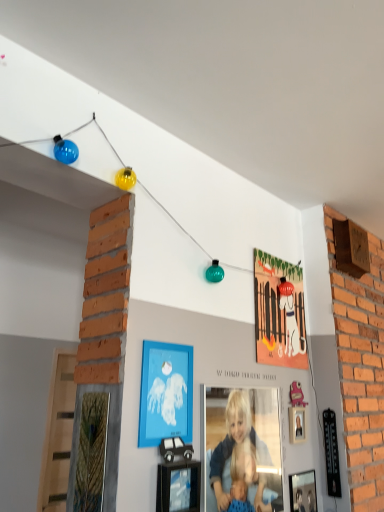
Question: Is blue matte picture frame at center, the 3th picture frame from the back, positioned before matte orange picture frame at upper center, arranged as the 2th picture frame when viewed from the right?

Choices:
 (A) no
 (B) yes

Answer: (B)

Question: Does blue matte picture frame at center, which ranks as the 1th picture frame in left-to-right order, turn towards matte orange picture frame at upper center, the first picture frame positioned from the back?

Choices:
 (A) no
 (B) yes

Answer: (A)

Question: Does blue matte picture frame at center, which ranks as the 1th picture frame in left-to-right order, appear on the left side of matte orange picture frame at upper center, which is counted as the first picture frame, starting from the top?

Choices:
 (A) no
 (B) yes

Answer: (B)

Question: From the image's perspective, is blue matte picture frame at center, which ranks as the 1th picture frame in left-to-right order, on matte orange picture frame at upper center, the third picture frame from the left?

Choices:
 (A) yes
 (B) no

Answer: (B)

Question: From a real-world perspective, is blue matte picture frame at center, which ranks as the fourth picture frame in right-to-left order, on top of matte orange picture frame at upper center, the first picture frame positioned from the back?

Choices:
 (A) no
 (B) yes

Answer: (A)

Question: From a real-world perspective, relative to blue matte picture frame at center, which is the 2th picture frame from front to back, is matte orange picture frame at upper center, which appears as the fourth picture frame when ordered from the bottom, vertically above or below?

Choices:
 (A) above
 (B) below

Answer: (A)

Question: Is matte orange picture frame at upper center, marked as the fourth picture frame in a front-to-back arrangement, wider or thinner than blue matte picture frame at center, which appears as the third picture frame when ordered from the bottom?

Choices:
 (A) thin
 (B) wide

Answer: (B)

Question: Considering the positions of matte orange picture frame at upper center, the third picture frame from the left, and blue matte picture frame at center, which is the 2th picture frame from front to back, in the image, is matte orange picture frame at upper center, the third picture frame from the left, taller or shorter than blue matte picture frame at center, which is the 2th picture frame from front to back,?

Choices:
 (A) short
 (B) tall

Answer: (B)

Question: Is matte orange picture frame at upper center, the third picture frame from the left, bigger or smaller than blue matte picture frame at center, which is the 2th picture frame from front to back?

Choices:
 (A) small
 (B) big

Answer: (B)

Question: Is point (173, 489) positioned closer to the camera than point (185, 372)?

Choices:
 (A) farther
 (B) closer

Answer: (B)

Question: Based on their positions, is black cardboard car at lower center, the third picture frame when ordered from right to left, located to the left or right of blue matte picture frame at center, the 2th picture frame viewed from the top?

Choices:
 (A) right
 (B) left

Answer: (A)

Question: From their relative heights in the image, would you say black cardboard car at lower center, which is the second picture frame from left to right, is taller or shorter than blue matte picture frame at center, the 3th picture frame from the back?

Choices:
 (A) short
 (B) tall

Answer: (A)

Question: From a real-world perspective, relative to blue matte picture frame at center, which is the 2th picture frame from front to back, is black cardboard car at lower center, arranged as the 3th picture frame when viewed from the top, vertically above or below?

Choices:
 (A) above
 (B) below

Answer: (B)

Question: Is point (157, 423) positioned closer to the camera than point (273, 307)?

Choices:
 (A) farther
 (B) closer

Answer: (B)

Question: From a real-world perspective, is blue matte picture frame at center, which appears as the third picture frame when ordered from the bottom, above or below matte orange picture frame at upper center, arranged as the 2th picture frame when viewed from the right?

Choices:
 (A) above
 (B) below

Answer: (B)